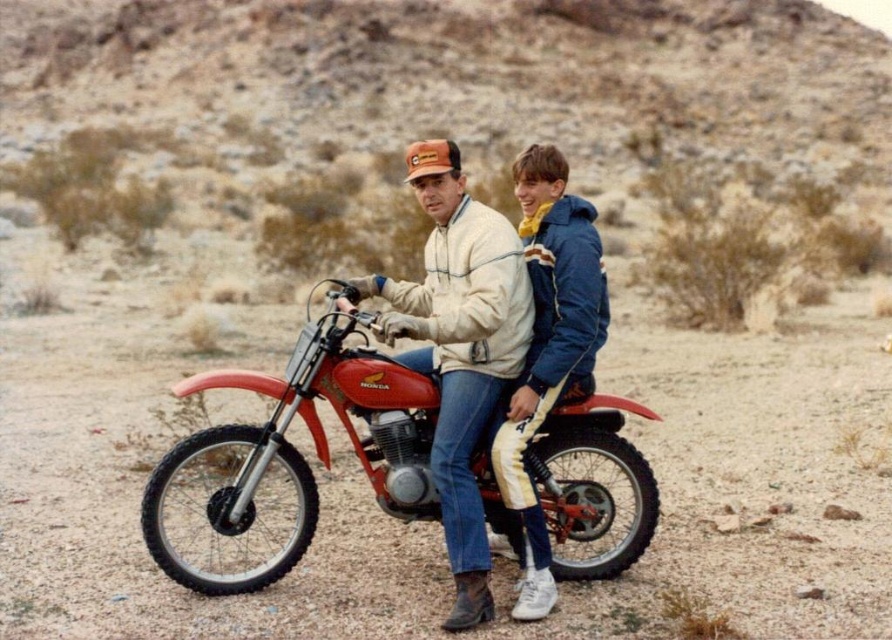
Who is more forward, (538, 212) or (577, 400)?

Positioned in front is point (577, 400).

Can you confirm if white fleece jacket at center is thinner than shiny red dirt bike at center?

Yes.

Where is `white fleece jacket at center`? This screenshot has height=640, width=892. white fleece jacket at center is located at coordinates (494, 353).

In order to click on white fleece jacket at center in this screenshot , I will do `click(494, 353)`.